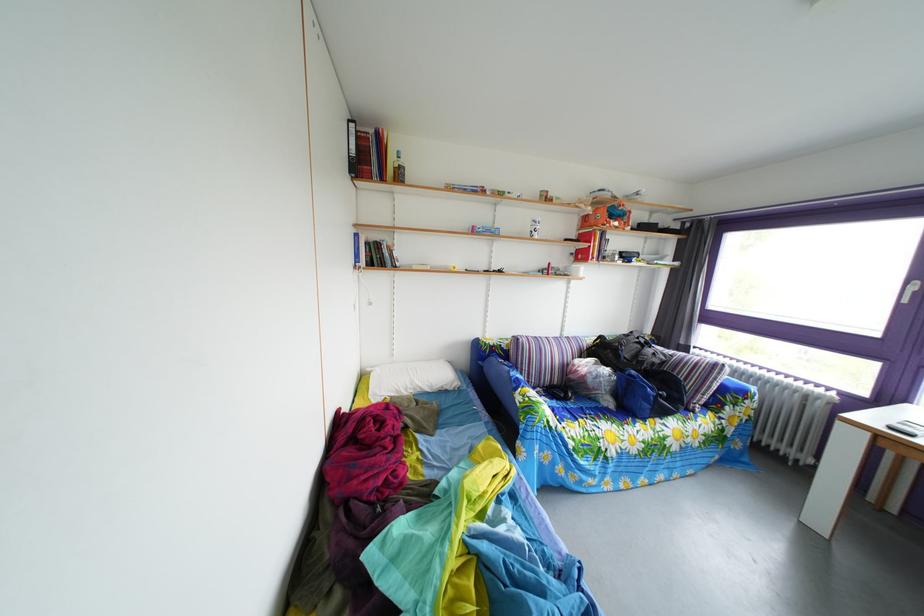
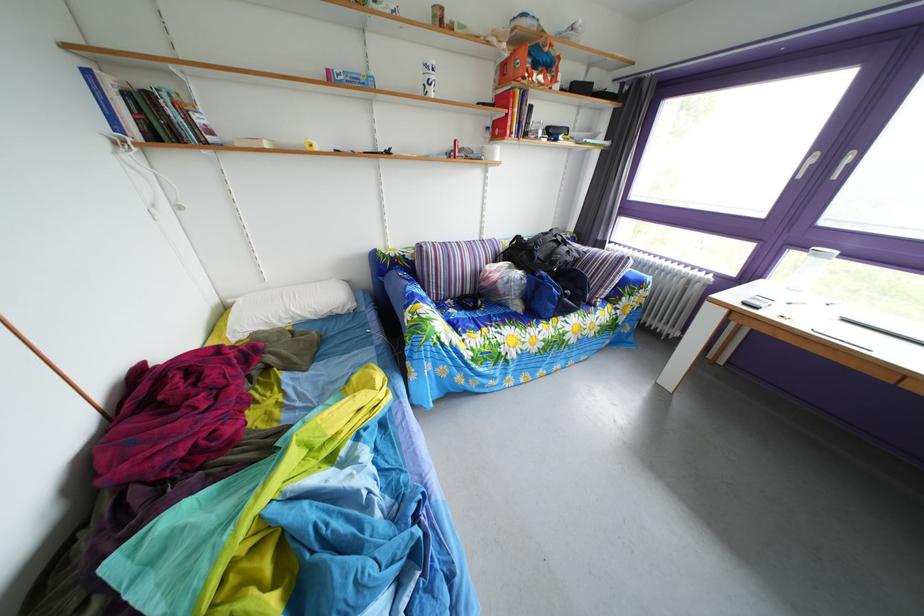
The images are taken continuously from a first-person perspective. In which direction are you moving?

The cameraman walked toward right, forward.